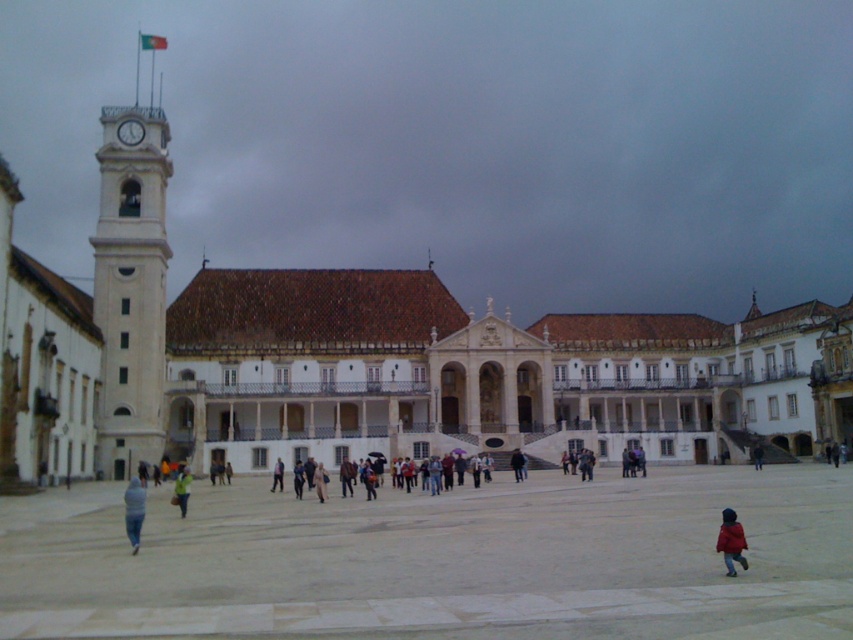
Which is above, white stone clock tower at left or red woolen coat at lower right?

Positioned higher is white stone clock tower at left.

Does point (148, 456) come in front of point (729, 552)?

That is False.

Between point (137, 157) and point (730, 570), which one is positioned behind?

The point (137, 157) is more distant.

Identify the location of white stone clock tower at left. This screenshot has height=640, width=853. (131, 285).

Can you confirm if white stone clock tower at left is positioned to the right of blue fuzzy jacket at lower left?

In fact, white stone clock tower at left is to the left of blue fuzzy jacket at lower left.

Who is more forward, (157, 323) or (129, 483)?

Point (129, 483) is more forward.

Find the location of `white stone clock tower at left`. white stone clock tower at left is located at coordinates (131, 285).

How far apart are red woolen coat at lower right and green fabric jacket at lower left?

They are 145.28 feet apart.

Between red woolen coat at lower right and green fabric jacket at lower left, which one has more height?

Standing taller between the two is green fabric jacket at lower left.

Does point (718, 528) come behind point (189, 492)?

No, it is not.

Image resolution: width=853 pixels, height=640 pixels. I want to click on red woolen coat at lower right, so click(x=730, y=541).